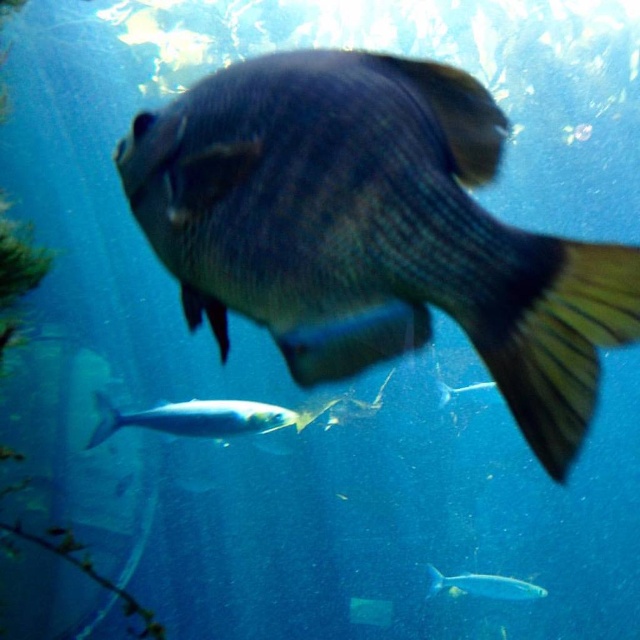
Question: Is shiny blue fish at center positioned in front of shiny silver fish at lower center?

Choices:
 (A) yes
 (B) no

Answer: (A)

Question: Can you confirm if shiny blue fish at center is bigger than shiny silver fish at lower center?

Choices:
 (A) no
 (B) yes

Answer: (A)

Question: Is shiny blue fish at center bigger than shiny silver fish at center?

Choices:
 (A) no
 (B) yes

Answer: (B)

Question: Which of the following is the closest to the observer?

Choices:
 (A) shiny silver fish at center
 (B) shiny blue fish at center

Answer: (B)

Question: Estimate the real-world distances between objects in this image. Which object is closer to the shiny silver fish at lower center?

Choices:
 (A) shiny silver fish at center
 (B) shiny blue fish at center

Answer: (A)

Question: Which object is closer to the camera taking this photo?

Choices:
 (A) shiny silver fish at lower center
 (B) shiny silver fish at center

Answer: (A)